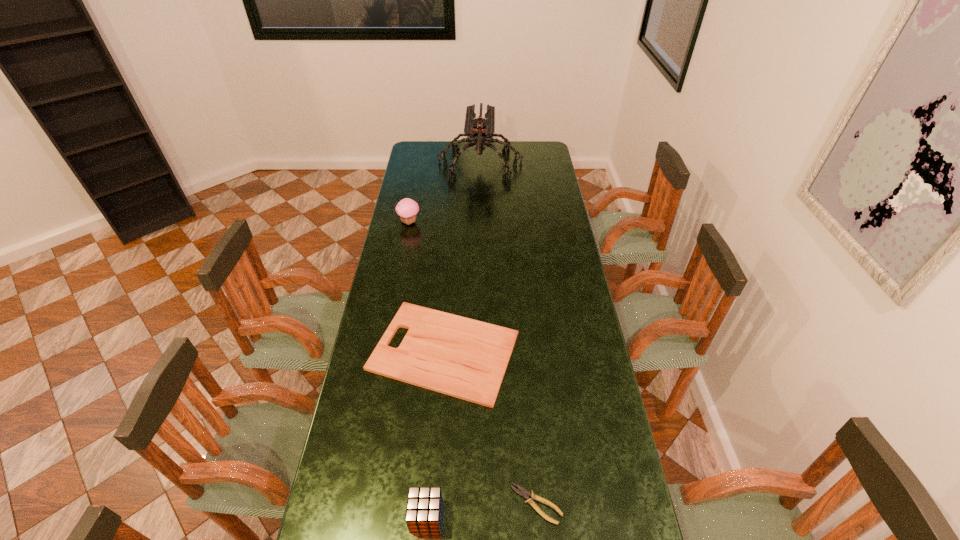
You are a GUI agent. You are given a task and a screenshot of the screen. Output one action in this format:
    pyautogui.click(x=<x>, y=<y>)
    Task: Click on the free space between the third nearest object and the pliers
    Image resolution: width=960 pixels, height=540 pixels.
    Given the screenshot: What is the action you would take?
    point(491,428)

This screenshot has width=960, height=540. In order to click on blank region between the cube and the pliers in this screenshot , I will do `click(481, 510)`.

This screenshot has height=540, width=960. I want to click on free spot between the shortest object and the third tallest object, so tap(481, 510).

Select which object is the closest to the shortest object. Please provide its 2D coordinates. Your answer should be formatted as a tuple, i.e. [(x, y)], where the tuple contains the x and y coordinates of a point satisfying the conditions above.

[(424, 507)]

Select which object is the third closest to the third farthest object. Please provide its 2D coordinates. Your answer should be formatted as a tuple, i.e. [(x, y)], where the tuple contains the x and y coordinates of a point satisfying the conditions above.

[(407, 209)]

Find the location of a particular element. This screenshot has width=960, height=540. free region that satisfies the following two spatial constraints: 1. on the back side of the fourth shortest object; 2. on the right side of the farthest object is located at coordinates (420, 165).

Identify the location of free space that satisfies the following two spatial constraints: 1. on the front side of the shortest object; 2. on the left side of the third farthest object. (433, 504).